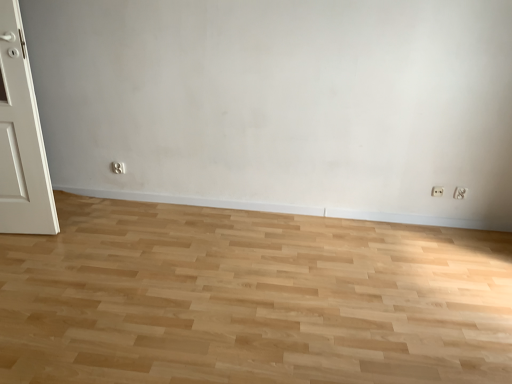
Locate an element on the screen. This screenshot has width=512, height=384. white plastic electric outlet at lower right, which is counted as the second electric outlet, starting from the right is located at coordinates (437, 191).

You are a GUI agent. You are given a task and a screenshot of the screen. Output one action in this format:
    pyautogui.click(x=<x>, y=<y>)
    Task: Click on the natural wood floor at center
    The image size is (512, 384).
    Given the screenshot: What is the action you would take?
    pyautogui.click(x=251, y=299)

Considering the sizes of objects natural wood floor at center and white plastic electric outlet at lower right, positioned as the first electric outlet in right-to-left order, in the image provided, who is taller, natural wood floor at center or white plastic electric outlet at lower right, positioned as the first electric outlet in right-to-left order,?

Standing taller between the two is white plastic electric outlet at lower right, positioned as the first electric outlet in right-to-left order.

Is natural wood floor at center turned away from white plastic electric outlet at lower right, positioned as the first electric outlet in right-to-left order?

No, natural wood floor at center's orientation is not away from white plastic electric outlet at lower right, positioned as the first electric outlet in right-to-left order.

From the image's perspective, is natural wood floor at center located beneath white plastic electric outlet at lower right, which ranks as the second electric outlet in left-to-right order?

Yes, from the image's perspective, natural wood floor at center is beneath white plastic electric outlet at lower right, which ranks as the second electric outlet in left-to-right order.

Between natural wood floor at center and white plastic electric outlet at lower right, acting as the first electric outlet starting from the left, which one has smaller size?

With smaller size is white plastic electric outlet at lower right, acting as the first electric outlet starting from the left.

Is natural wood floor at center completely or partially outside of white plastic electric outlet at lower right, acting as the first electric outlet starting from the left?

Absolutely, natural wood floor at center is external to white plastic electric outlet at lower right, acting as the first electric outlet starting from the left.

Which is in front, point (380, 288) or point (439, 194)?

The point (380, 288) is more forward.

Looking at the image, does white plastic electric outlet at lower right, positioned as the first electric outlet in right-to-left order, seem bigger or smaller compared to white plastic electric outlet at lower right, acting as the first electric outlet starting from the left?

Considering their sizes, white plastic electric outlet at lower right, positioned as the first electric outlet in right-to-left order, takes up more space than white plastic electric outlet at lower right, acting as the first electric outlet starting from the left.

Between point (456, 192) and point (436, 187), which one is positioned behind?

The point (436, 187) is more distant.

Could you measure the distance between white plastic electric outlet at lower right, positioned as the first electric outlet in right-to-left order, and white plastic electric outlet at lower right, which is counted as the second electric outlet, starting from the right?

white plastic electric outlet at lower right, positioned as the first electric outlet in right-to-left order, and white plastic electric outlet at lower right, which is counted as the second electric outlet, starting from the right, are 11.39 centimeters apart.

Can you tell me how much white plastic electric outlet at lower right, which ranks as the second electric outlet in left-to-right order, and white plastic electric outlet at lower right, acting as the first electric outlet starting from the left, differ in facing direction?

The angular difference between white plastic electric outlet at lower right, which ranks as the second electric outlet in left-to-right order, and white plastic electric outlet at lower right, acting as the first electric outlet starting from the left, is 0.00183 degrees.

From the image's perspective, would you say white plastic electric outlet at lower right, positioned as the first electric outlet in right-to-left order, is shown under natural wood floor at center?

Actually, white plastic electric outlet at lower right, positioned as the first electric outlet in right-to-left order, appears above natural wood floor at center in the image.

Based on the photo, is white plastic electric outlet at lower right, which ranks as the second electric outlet in left-to-right order, shorter than natural wood floor at center?

No.

Which is behind, point (465, 193) or point (139, 376)?

The point (465, 193) is farther from the camera.

Considering the sizes of objects white plastic electric outlet at lower right, which ranks as the second electric outlet in left-to-right order, and natural wood floor at center in the image provided, who is thinner, white plastic electric outlet at lower right, which ranks as the second electric outlet in left-to-right order, or natural wood floor at center?

white plastic electric outlet at lower right, which ranks as the second electric outlet in left-to-right order.

In the scene shown: Is white plastic electric outlet at lower right, acting as the first electric outlet starting from the left, not inside white plastic electric outlet at lower right, which ranks as the second electric outlet in left-to-right order?

Absolutely, white plastic electric outlet at lower right, acting as the first electric outlet starting from the left, is external to white plastic electric outlet at lower right, which ranks as the second electric outlet in left-to-right order.

In the scene shown: Considering the relative positions of white plastic electric outlet at lower right, acting as the first electric outlet starting from the left, and white plastic electric outlet at lower right, which ranks as the second electric outlet in left-to-right order, in the image provided, is white plastic electric outlet at lower right, acting as the first electric outlet starting from the left, to the right of white plastic electric outlet at lower right, which ranks as the second electric outlet in left-to-right order, from the viewer's perspective?

Incorrect, white plastic electric outlet at lower right, acting as the first electric outlet starting from the left, is not on the right side of white plastic electric outlet at lower right, which ranks as the second electric outlet in left-to-right order.

Between white plastic electric outlet at lower right, which is counted as the second electric outlet, starting from the right, and white plastic electric outlet at lower right, positioned as the first electric outlet in right-to-left order, which one has more height?

With more height is white plastic electric outlet at lower right, positioned as the first electric outlet in right-to-left order.

Measure the distance between white plastic electric outlet at lower right, acting as the first electric outlet starting from the left, and natural wood floor at center.

white plastic electric outlet at lower right, acting as the first electric outlet starting from the left, is 5.00 feet away from natural wood floor at center.

Locate an element on the screen. The image size is (512, 384). plain below the white plastic electric outlet at lower right, acting as the first electric outlet starting from the left (from the image's perspective) is located at coordinates (251, 299).

Is white plastic electric outlet at lower right, which is counted as the second electric outlet, starting from the right, touching natural wood floor at center?

No, white plastic electric outlet at lower right, which is counted as the second electric outlet, starting from the right, is not beside natural wood floor at center.

Looking at this image, from their relative heights in the image, would you say white plastic electric outlet at lower right, which is counted as the second electric outlet, starting from the right, is taller or shorter than natural wood floor at center?

In the image, white plastic electric outlet at lower right, which is counted as the second electric outlet, starting from the right, appears to be taller than natural wood floor at center.

Image resolution: width=512 pixels, height=384 pixels. I want to click on plain below the white plastic electric outlet at lower right, which ranks as the second electric outlet in left-to-right order (from the image's perspective), so click(251, 299).

This screenshot has height=384, width=512. Find the location of `plain lying in front of the white plastic electric outlet at lower right, acting as the first electric outlet starting from the left`. plain lying in front of the white plastic electric outlet at lower right, acting as the first electric outlet starting from the left is located at coordinates (251, 299).

Based on the photo, considering their positions, is white plastic electric outlet at lower right, which is counted as the second electric outlet, starting from the right, positioned closer to white plastic electric outlet at lower right, positioned as the first electric outlet in right-to-left order, than natural wood floor at center?

The object closer to white plastic electric outlet at lower right, positioned as the first electric outlet in right-to-left order, is white plastic electric outlet at lower right, which is counted as the second electric outlet, starting from the right.

Which object lies nearer to the anchor point white plastic electric outlet at lower right, which is counted as the second electric outlet, starting from the right, natural wood floor at center or white plastic electric outlet at lower right, positioned as the first electric outlet in right-to-left order?

white plastic electric outlet at lower right, positioned as the first electric outlet in right-to-left order, is closer to white plastic electric outlet at lower right, which is counted as the second electric outlet, starting from the right.

Which object lies further to the anchor point white plastic electric outlet at lower right, which ranks as the second electric outlet in left-to-right order, natural wood floor at center or white plastic electric outlet at lower right, which is counted as the second electric outlet, starting from the right?

The object further to white plastic electric outlet at lower right, which ranks as the second electric outlet in left-to-right order, is natural wood floor at center.

Which object lies nearer to the anchor point white plastic electric outlet at lower right, acting as the first electric outlet starting from the left, white plastic electric outlet at lower right, positioned as the first electric outlet in right-to-left order, or natural wood floor at center?

white plastic electric outlet at lower right, positioned as the first electric outlet in right-to-left order, lies closer to white plastic electric outlet at lower right, acting as the first electric outlet starting from the left, than the other object.

Based on their spatial positions, is white plastic electric outlet at lower right, positioned as the first electric outlet in right-to-left order, or white plastic electric outlet at lower right, which is counted as the second electric outlet, starting from the right, closer to natural wood floor at center?

white plastic electric outlet at lower right, which is counted as the second electric outlet, starting from the right, is positioned closer to the anchor natural wood floor at center.

Considering their positions, is white plastic electric outlet at lower right, which is counted as the second electric outlet, starting from the right, positioned closer to natural wood floor at center than white plastic electric outlet at lower right, which ranks as the second electric outlet in left-to-right order?

Among the two, white plastic electric outlet at lower right, which is counted as the second electric outlet, starting from the right, is located nearer to natural wood floor at center.

Identify the location of electric outlet between natural wood floor at center and white plastic electric outlet at lower right, acting as the first electric outlet starting from the left, in the front-back direction. (460, 193).